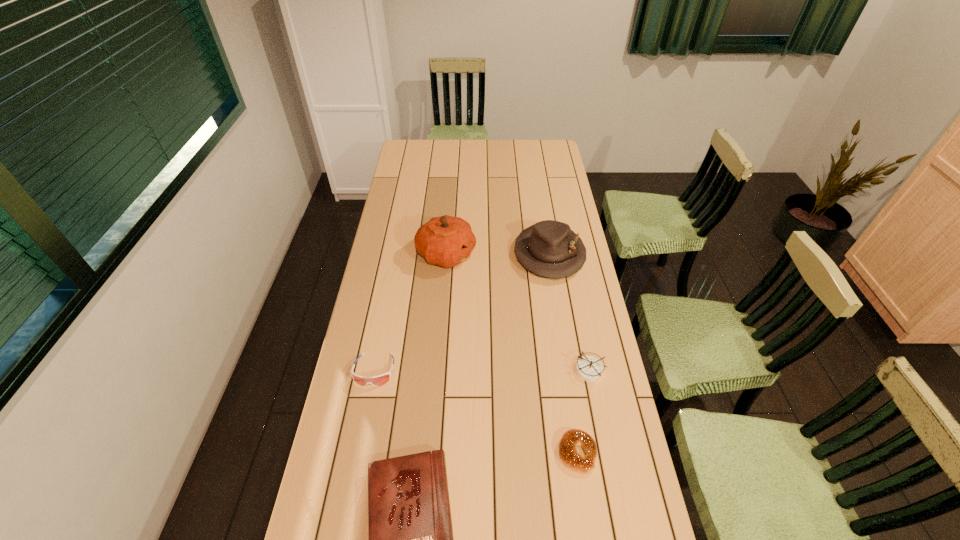
Locate an element on the screen. This screenshot has height=540, width=960. pumpkin at the left edge is located at coordinates (446, 241).

Identify the location of goggles located in the left edge section of the desktop. (378, 380).

Identify the location of hat located at the right edge. The width and height of the screenshot is (960, 540). (549, 248).

This screenshot has height=540, width=960. I want to click on compass located in the right edge section of the desktop, so click(590, 369).

Where is `bagel at the right edge`? bagel at the right edge is located at coordinates (573, 438).

The image size is (960, 540). What are the coordinates of `vacant area at the far edge` in the screenshot? It's located at (x=508, y=140).

Where is `free space at the left edge of the desktop`? free space at the left edge of the desktop is located at coordinates (368, 323).

Locate an element on the screen. vacant space at the right edge of the desktop is located at coordinates (562, 211).

At what (x,y) coordinates should I click in order to perform the action: click on vacant space at the far left corner of the desktop. Please return your answer as a coordinate pair (x, y). Looking at the image, I should click on (409, 151).

Find the location of `vacant area that lies between the compass and the bagel`. vacant area that lies between the compass and the bagel is located at coordinates coord(584,411).